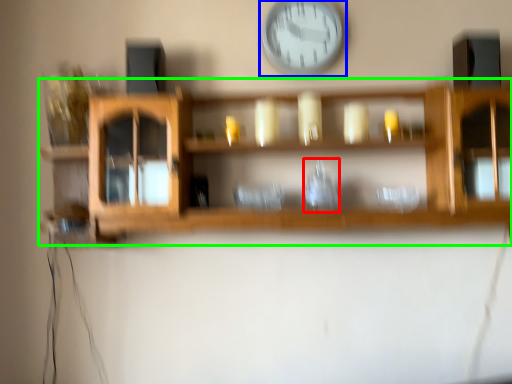
Question: Which is farther away from glass vase (highlighted by a red box)? wall clock (highlighted by a blue box) or shelf (highlighted by a green box)?

Choices:
 (A) wall clock
 (B) shelf

Answer: (A)